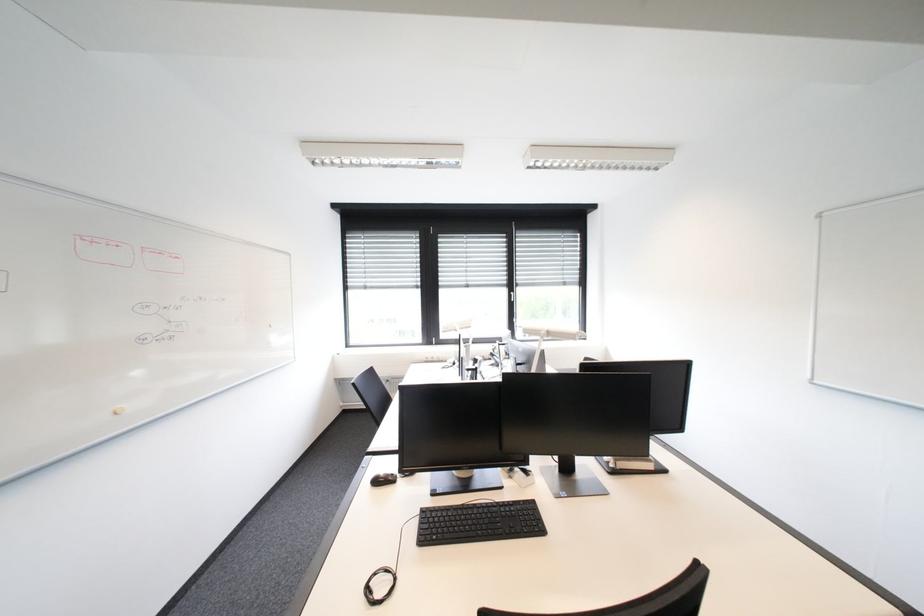
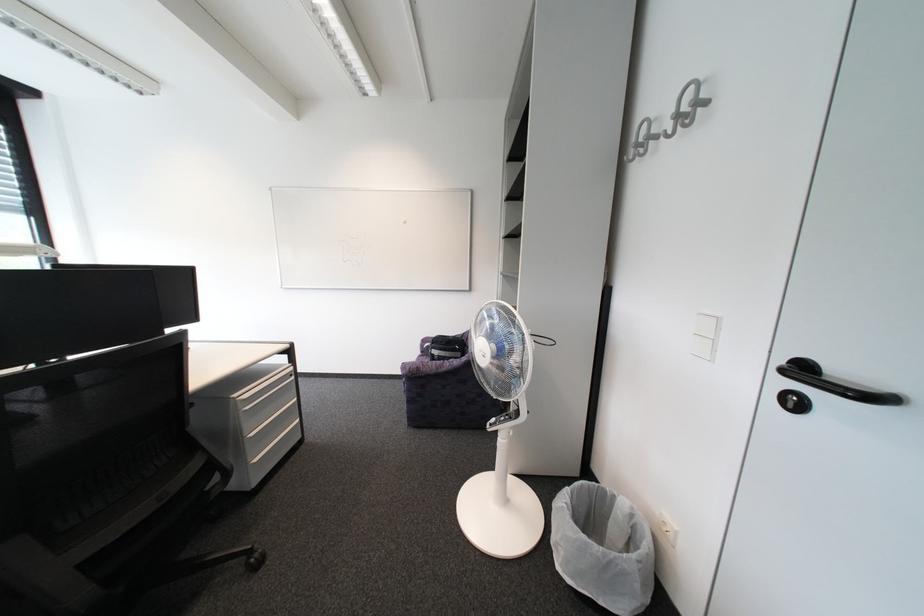
Question: The images are taken continuously from a first-person perspective. In which direction is your viewpoint rotating?

Choices:
 (A) Left
 (B) Right
 (C) Up
 (D) Down

Answer: (B)